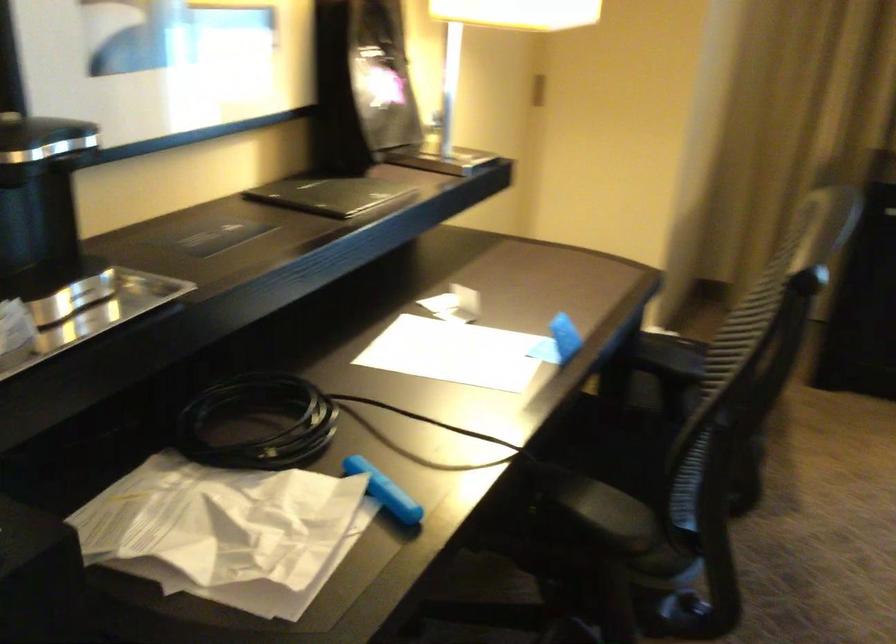
Find where to lift the coffee maker handle. Please return your answer as a coordinate pair (x, y).

(41, 138)